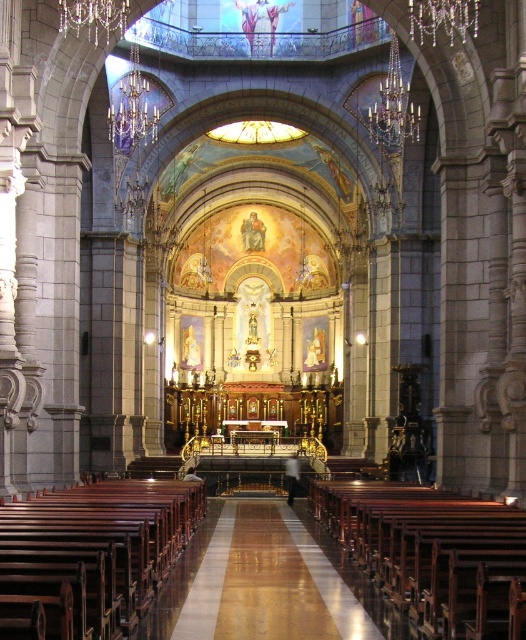
You are an architect designing a new cathedral and want to ensure the shiny polished wood aisle at center and the clear crystal chandelier at upper center are proportionate. Based on the image, which object is shorter?

The shiny polished wood aisle at center is shorter than the clear crystal chandelier at upper center according to the description.

You are standing at the entrance of the cathedral and want to find the chandelier. Which direction should you look to see the gold metallic chandelier at upper center relative to the polished wood pews at center?

The gold metallic chandelier at upper center is to the right of the polished wood pews at center.